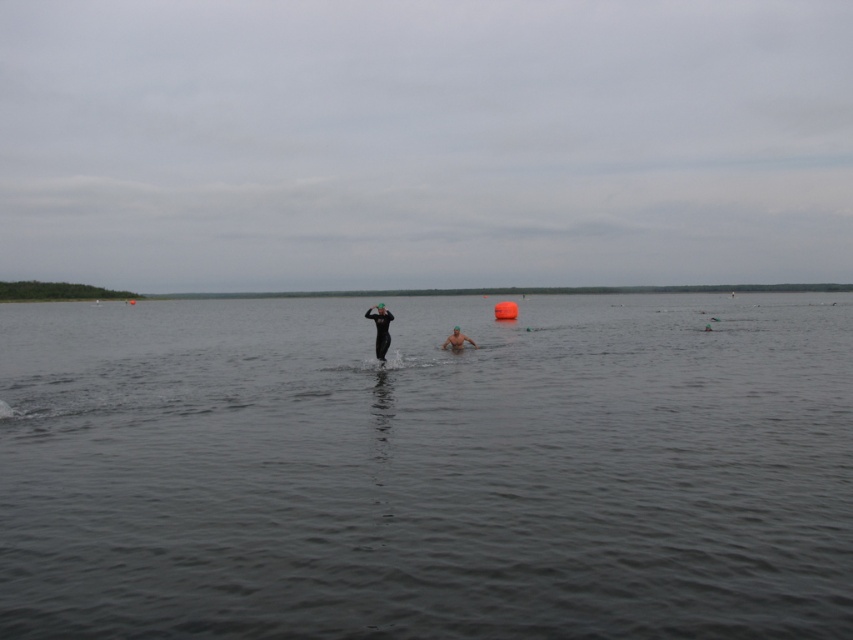
Who is lower down, dark gray water at center or smooth skin person at center?

smooth skin person at center is below.

Can you confirm if dark gray water at center is positioned above smooth skin person at center?

Yes, dark gray water at center is above smooth skin person at center.

Describe the element at coordinates (427, 468) in the screenshot. I see `dark gray water at center` at that location.

Identify the location of dark gray water at center. This screenshot has height=640, width=853. (427, 468).

Is point (149, 516) less distant than point (381, 337)?

Yes.

Looking at this image, which is more to the left, dark gray water at center or black matte wetsuit at center?

dark gray water at center

Is point (444, 448) in front of point (379, 340)?

Yes.

Locate an element on the screen. The height and width of the screenshot is (640, 853). dark gray water at center is located at coordinates (427, 468).

Between black matte wetsuit at center and smooth skin person at center, which one has less height?

smooth skin person at center

Who is positioned more to the left, black matte wetsuit at center or smooth skin person at center?

From the viewer's perspective, black matte wetsuit at center appears more on the left side.

Is point (383, 333) in front of point (476, 348)?

Yes, it is in front of point (476, 348).

Find the location of a particular element. The width and height of the screenshot is (853, 640). black matte wetsuit at center is located at coordinates (380, 328).